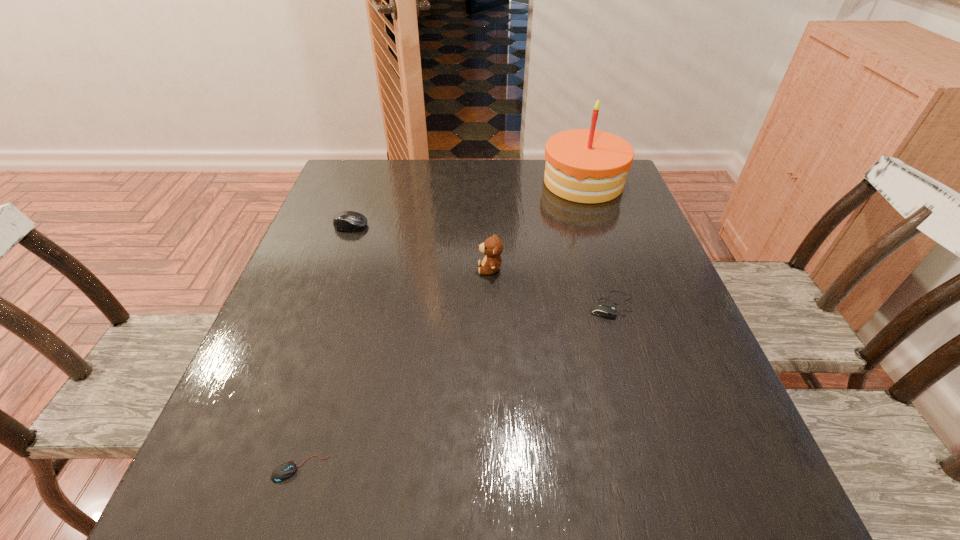
Find the location of `computer mouse that is at the right edge`. computer mouse that is at the right edge is located at coordinates (601, 309).

At what (x,y) coordinates should I click in order to perform the action: click on object that is positioned at the near left corner. Please return your answer as a coordinate pair (x, y). Looking at the image, I should click on (285, 470).

Where is `object positioned at the far right corner`? object positioned at the far right corner is located at coordinates (589, 166).

Where is `vacant space at the far edge of the desktop`? The height and width of the screenshot is (540, 960). vacant space at the far edge of the desktop is located at coordinates (x=444, y=188).

Where is `vacant space at the left edge of the desktop`? vacant space at the left edge of the desktop is located at coordinates (299, 423).

Find the location of `vacant position at the right edge of the desktop`. vacant position at the right edge of the desktop is located at coordinates (x=677, y=352).

I want to click on vacant space at the far left corner, so click(x=382, y=184).

In order to click on vacant space at the far right corner in this screenshot , I will do `click(604, 203)`.

At what (x,y) coordinates should I click in order to perform the action: click on unoccupied position between the teddy bear and the nearest mouse. Please return your answer as a coordinate pair (x, y). The image size is (960, 540). Looking at the image, I should click on (396, 369).

The width and height of the screenshot is (960, 540). Find the location of `free point between the fourth shortest object and the fourth tallest object`. free point between the fourth shortest object and the fourth tallest object is located at coordinates (551, 287).